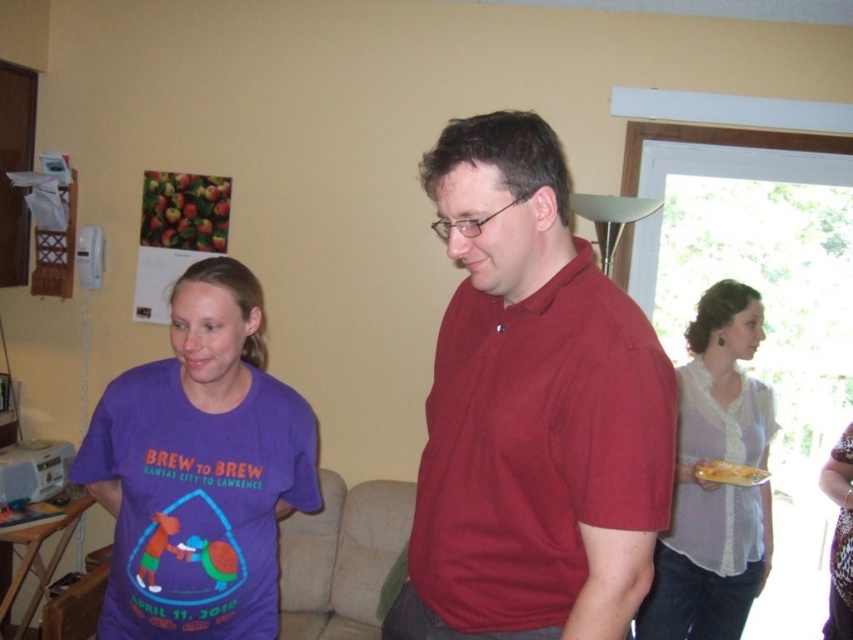
Question: Which of the following is the closest to the observer?

Choices:
 (A) yellow plastic plate at right
 (B) matte red shirt at center
 (C) purple cotton t-shirt at left
 (D) white sheer blouse at center

Answer: (B)

Question: Is matte red shirt at center to the left of purple cotton t-shirt at left from the viewer's perspective?

Choices:
 (A) yes
 (B) no

Answer: (B)

Question: Which point is closer to the camera taking this photo?

Choices:
 (A) (755, 332)
 (B) (437, 470)

Answer: (B)

Question: Is matte red shirt at center to the right of purple cotton t-shirt at left from the viewer's perspective?

Choices:
 (A) no
 (B) yes

Answer: (B)

Question: Which is nearer to the purple cotton t-shirt at left?

Choices:
 (A) matte red shirt at center
 (B) yellow plastic plate at right

Answer: (A)

Question: Is matte red shirt at center thinner than purple cotton t-shirt at left?

Choices:
 (A) yes
 (B) no

Answer: (A)